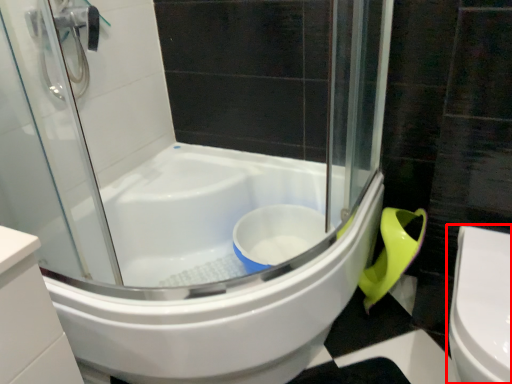
Question: From the image's perspective, where is toilet (annotated by the red box) located relative to bathtub?

Choices:
 (A) below
 (B) above

Answer: (A)